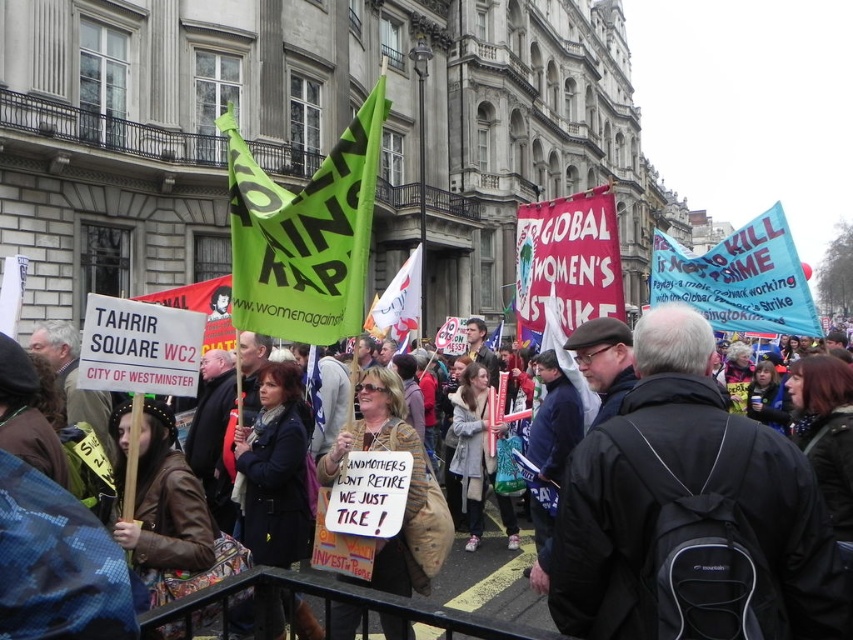
Between brown leather jacket at center and green fabric flag at center, which one appears on the right side from the viewer's perspective?

brown leather jacket at center is more to the right.

Which is behind, point (791, 516) or point (233, 196)?

The point (233, 196) is more distant.

The height and width of the screenshot is (640, 853). In order to click on brown leather jacket at center in this screenshot , I will do `click(793, 532)`.

Who is shorter, brown leather jacket at center or red fabric banner at center?

red fabric banner at center

Is brown leather jacket at center wider than red fabric banner at center?

Correct, the width of brown leather jacket at center exceeds that of red fabric banner at center.

Does point (573, 544) come farther from viewer compared to point (555, 282)?

No, (573, 544) is in front of (555, 282).

This screenshot has height=640, width=853. Find the location of `brown leather jacket at center`. brown leather jacket at center is located at coordinates (793, 532).

Is dark brown leather jacket at center to the left of leather jacket at center from the viewer's perspective?

In fact, dark brown leather jacket at center is to the right of leather jacket at center.

Can you confirm if dark brown leather jacket at center is smaller than leather jacket at center?

No, dark brown leather jacket at center is not smaller than leather jacket at center.

The width and height of the screenshot is (853, 640). In order to click on dark brown leather jacket at center in this screenshot , I will do `click(689, 504)`.

This screenshot has height=640, width=853. What are the coordinates of `dark brown leather jacket at center` in the screenshot? It's located at (x=689, y=504).